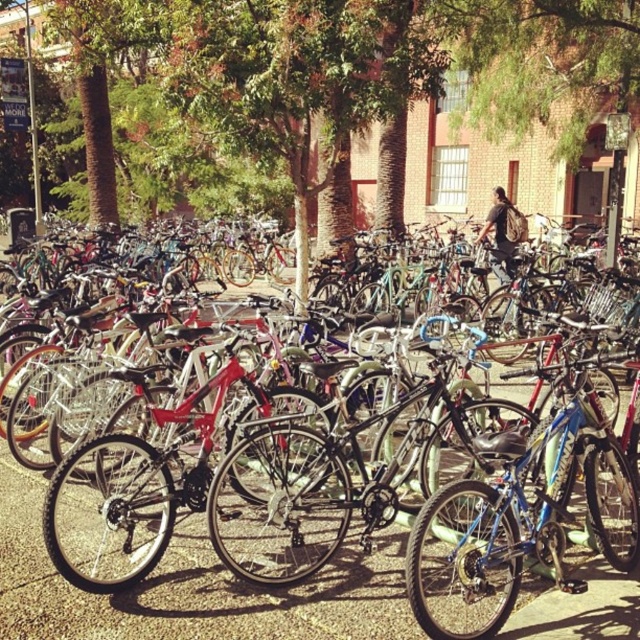
Question: Which object appears farthest from the camera in this image?

Choices:
 (A) shiny metallic bicycle at center
 (B) blue metallic bicycle at center

Answer: (A)

Question: Which object appears farthest from the camera in this image?

Choices:
 (A) shiny metallic bicycle at center
 (B) blue metallic bicycle at center

Answer: (A)

Question: Can you confirm if shiny metallic bicycle at center is positioned above blue metallic bicycle at center?

Choices:
 (A) no
 (B) yes

Answer: (A)

Question: Which of the following is the farthest from the observer?

Choices:
 (A) (509, 536)
 (B) (579, 486)

Answer: (B)

Question: Does shiny metallic bicycle at center have a smaller size compared to blue metallic bicycle at center?

Choices:
 (A) yes
 (B) no

Answer: (A)

Question: Observing the image, what is the correct spatial positioning of shiny metallic bicycle at center in reference to blue metallic bicycle at center?

Choices:
 (A) above
 (B) below

Answer: (B)